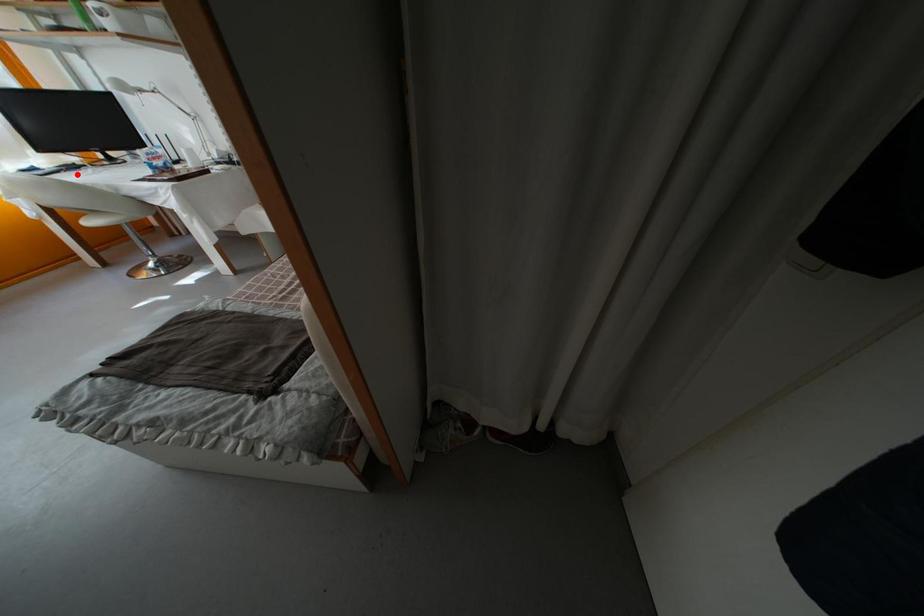
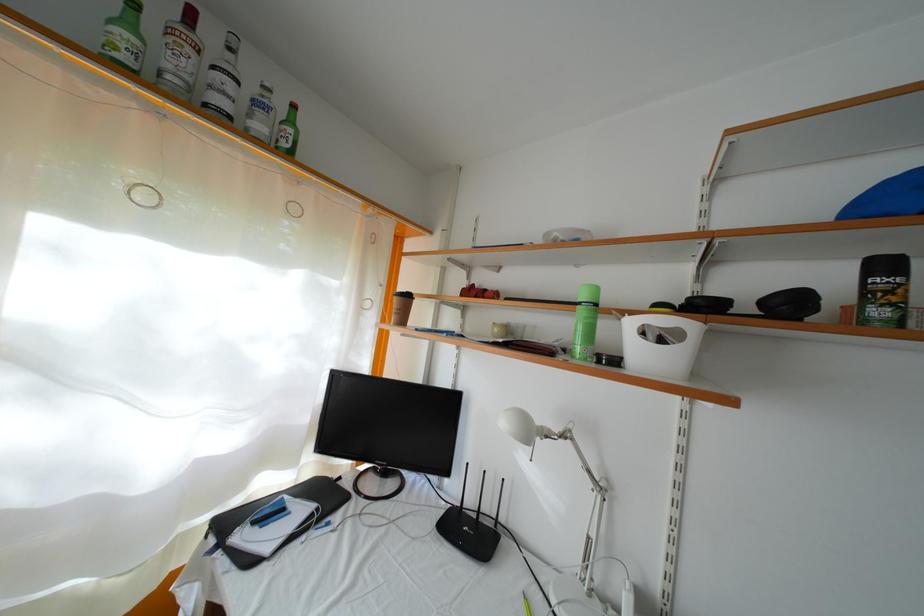
Question: I am providing you with two images of the same scene from different viewpoints. A red point is shown in image1. For the corresponding object point in image2, is it positioned nearer or farther from the camera?

Choices:
 (A) Nearer
 (B) Farther

Answer: (A)